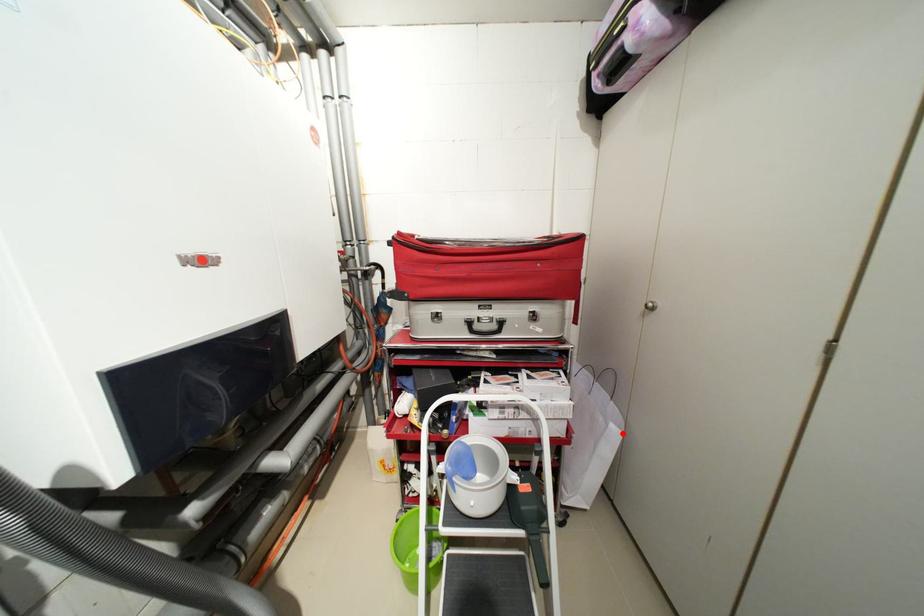
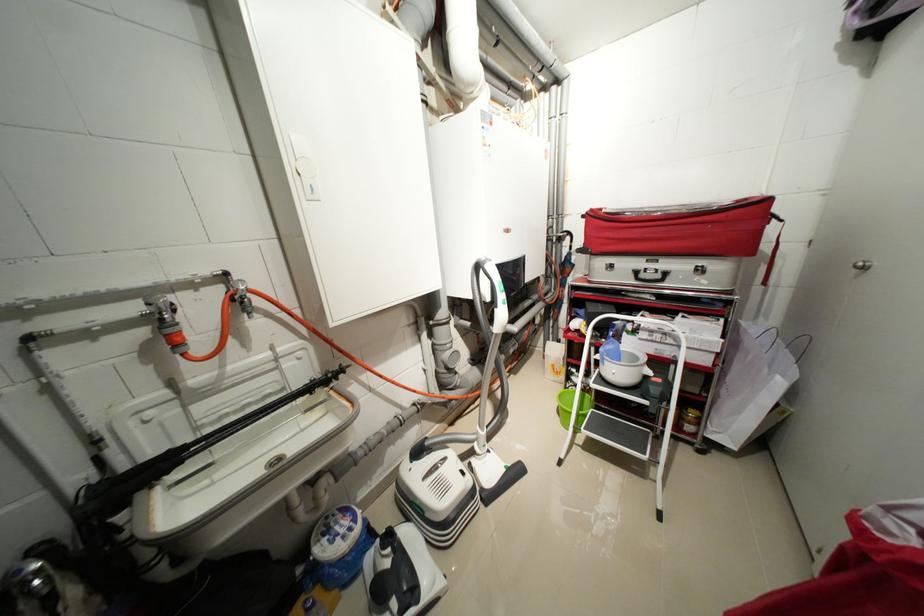
Question: I am providing you with two images of the same scene from different viewpoints. A red point is marked on the first image. Is the red point's position out of view in image 2?

Choices:
 (A) Yes
 (B) No

Answer: (B)